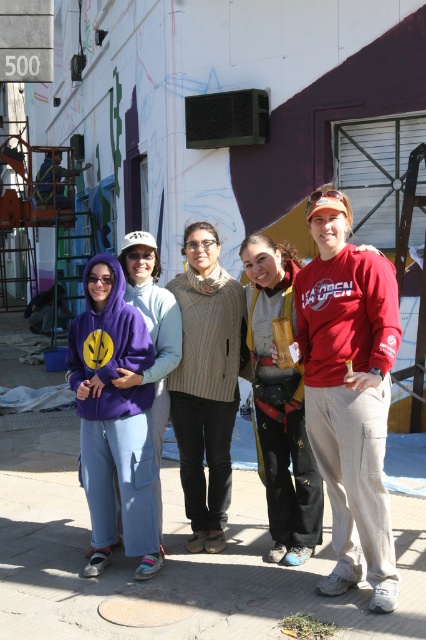
Question: Which object appears closest to the camera in this image?

Choices:
 (A) red cotton shirt at center
 (B) red cotton sweatshirt at right

Answer: (A)

Question: Does red cotton shirt at center appear on the left side of knitted beige sweater at center?

Choices:
 (A) yes
 (B) no

Answer: (B)

Question: Which point appears farthest from the camera in this image?

Choices:
 (A) (293, 563)
 (B) (146, 401)
 (C) (184, 368)

Answer: (C)

Question: Which of the following is the closest to the observer?

Choices:
 (A) (204, 296)
 (B) (308, 380)
 (C) (388, 284)
 (D) (81, 320)

Answer: (C)

Question: Where is red cotton shirt at center located in relation to red cotton sweatshirt at right in the image?

Choices:
 (A) above
 (B) below

Answer: (B)

Question: Is knitted beige sweater at center thinner than red cotton sweatshirt at right?

Choices:
 (A) no
 (B) yes

Answer: (A)